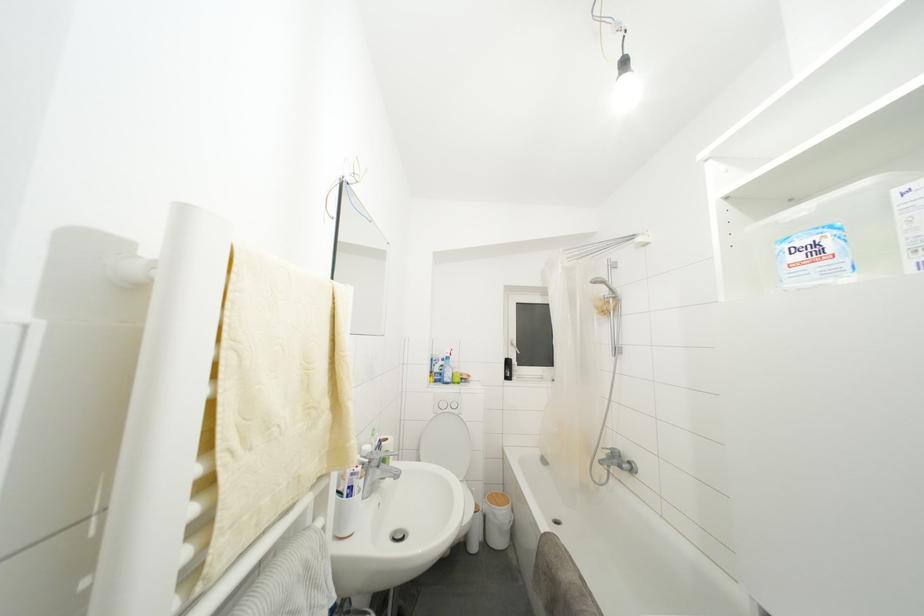
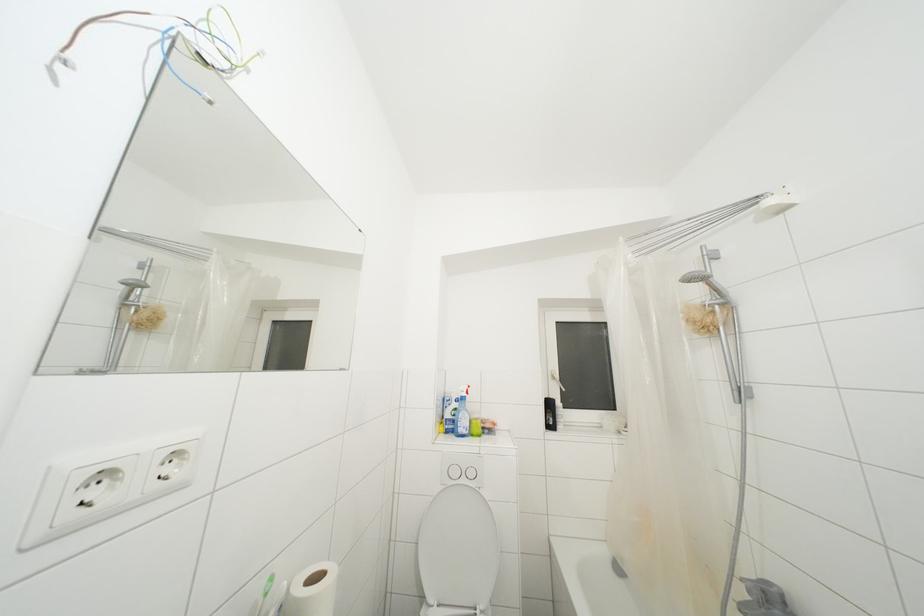
Question: How did the camera likely rotate?

Choices:
 (A) Left
 (B) Right
 (C) Up
 (D) Down

Answer: (A)